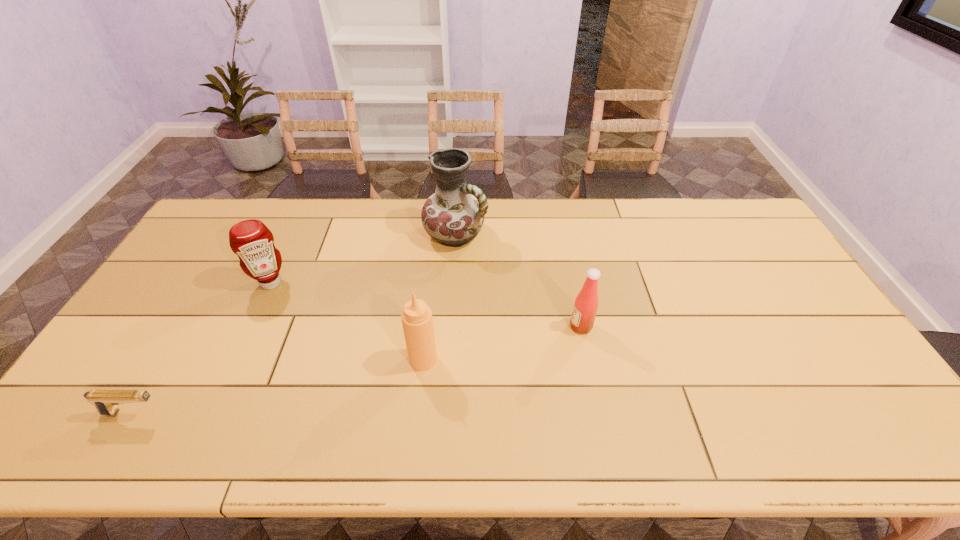
This screenshot has width=960, height=540. Find the location of `free location at the near edge`. free location at the near edge is located at coordinates (177, 425).

Locate an element on the screen. vacant space at the left edge of the desktop is located at coordinates (184, 258).

Locate an element on the screen. vacant region at the far right corner of the desktop is located at coordinates (739, 231).

Identify the location of free space at the near right corner. (877, 449).

Where is `vacant region between the tallest object and the third farthest object`? The width and height of the screenshot is (960, 540). vacant region between the tallest object and the third farthest object is located at coordinates (518, 281).

Find the location of a particular element. This screenshot has width=960, height=540. vacant space in between the farthest object and the farthest condiment is located at coordinates (363, 259).

Find the location of a particular element. The height and width of the screenshot is (540, 960). empty space between the nearest object and the leftmost condiment is located at coordinates (203, 348).

What are the coordinates of `free space between the rightmost condiment and the tallest object` in the screenshot? It's located at (518, 281).

Find the location of a particular element. vacant space that is in between the nearest condiment and the leftmost condiment is located at coordinates (348, 321).

Identify the location of vacant area that lies between the farthest object and the shortest object. The image size is (960, 540). (295, 324).